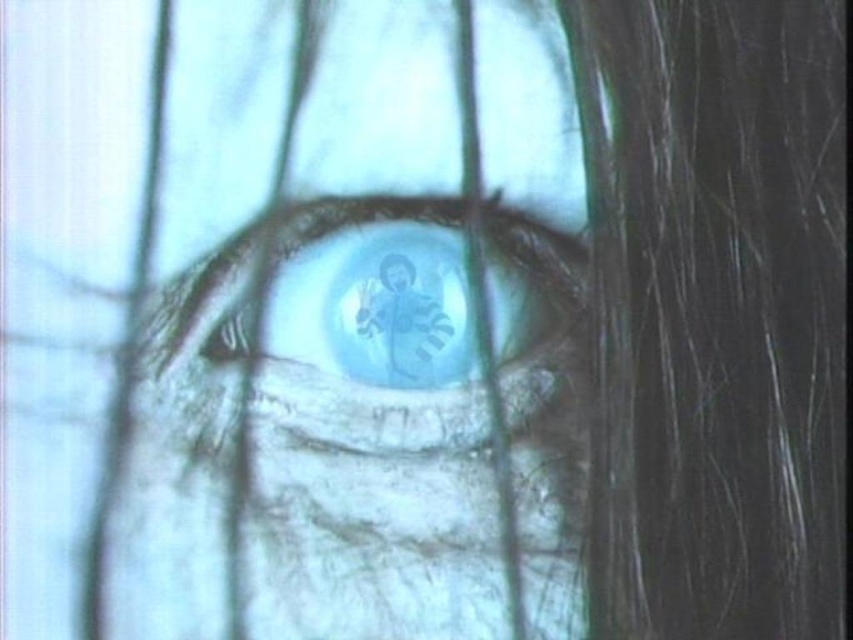
You are an optometrist examining a patient. You notice a translucent glass eye at center at point (373, 419). Where exactly is the translucent glass eye at center located?

The translucent glass eye at center is located at point (373, 419).

You are an optometrist examining a patient. You notice two eyes in the image, the translucent glass eye at center and the translucent blue eye at center. Which one is located below the other?

The translucent glass eye at center is positioned under the translucent blue eye at center, so the glass eye is below the blue eye.

You are an optometrist examining a patient. You notice the translucent glass eye at center. Where exactly is it located in the image?

The translucent glass eye at center is located at point coordinates of 0.656 on the x axis and 0.438 on the y axis.